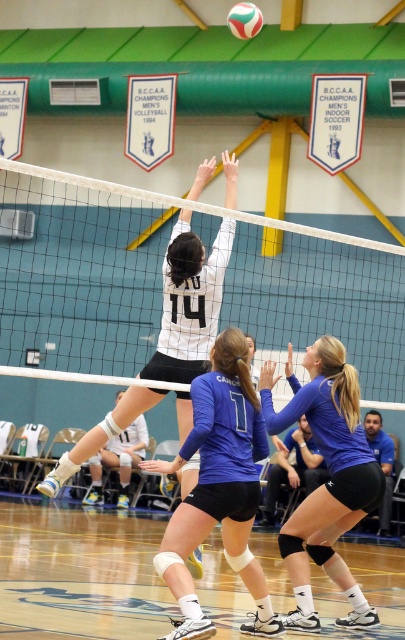
You are a photographer standing at the camera position. You want to take a photo of the volleyball game. The volleyball is at point (42, 221). If your camera has a focal length of 50mm, what is the approximate distance in meters between the volleyball and the camera?

The point (42, 221) and camera are 22.20 meters apart, so the volleyball is approximately 22.20 meters away from the camera.

You are a referee observing the volleyball match. You need to determine if the blue jersey at center is wider than the white matte volleyball at upper center. Can you confirm this?

The blue jersey at center might be wider than the white matte volleyball at upper center according to the description.

You are a volleyball player standing at the baseline of the gymnasium court. You want to hit the volleyball over the white mesh net at center located at point (x=161, y=285). What is the minimum height you need to jump to ensure the ball clears the net?

The white mesh net at center located at point (x=161, y=285) has a standard height of 2.24 meters for women. To ensure the ball clears the net, you need to jump high enough to hit the ball above this height, so the minimum jump height should be at least 2.24 meters.